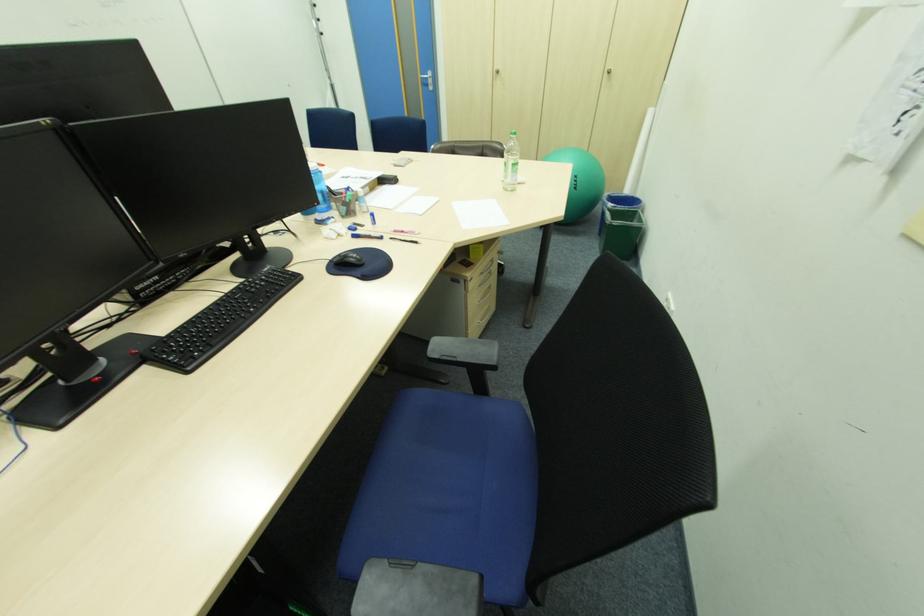
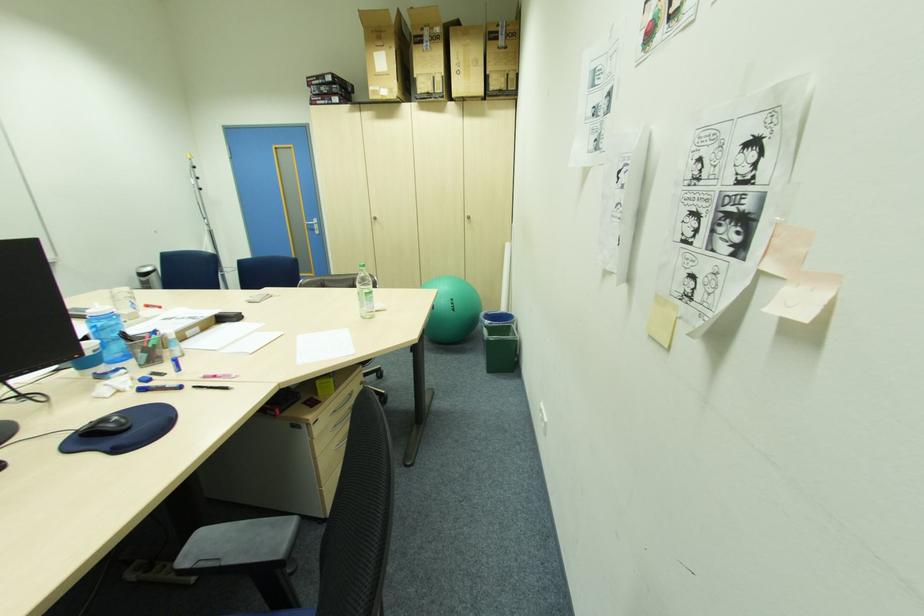
Question: In a continuous first-person perspective shot, in which direction is the camera moving?

Choices:
 (A) Left
 (B) Right
 (C) Forward
 (D) Backward

Answer: (B)